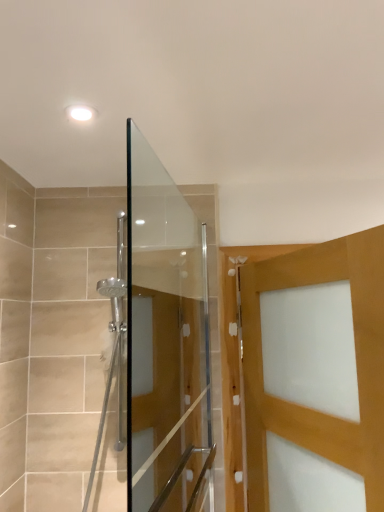
The width and height of the screenshot is (384, 512). Describe the element at coordinates (166, 342) in the screenshot. I see `transparent glass shower door at center` at that location.

Where is `transparent glass shower door at center`? This screenshot has width=384, height=512. transparent glass shower door at center is located at coordinates click(x=166, y=342).

What do you see at coordinates (356, 357) in the screenshot? I see `matte wooden door at right` at bounding box center [356, 357].

At what (x,y) coordinates should I click in order to perform the action: click on matte wooden door at right. Please return your answer as a coordinate pair (x, y). The width and height of the screenshot is (384, 512). Looking at the image, I should click on (356, 357).

I want to click on transparent glass shower door at center, so click(166, 342).

Considering the relative positions of matte wooden door at right and transparent glass shower door at center in the image provided, is matte wooden door at right to the right of transparent glass shower door at center from the viewer's perspective?

Indeed, matte wooden door at right is positioned on the right side of transparent glass shower door at center.

Which object is closer to the camera taking this photo, matte wooden door at right or transparent glass shower door at center?

transparent glass shower door at center is closer to the camera.

Is point (314, 445) closer or farther from the camera than point (157, 385)?

Point (314, 445).

From the image's perspective, between matte wooden door at right and transparent glass shower door at center, who is located below?

matte wooden door at right, from the image's perspective.

From a real-world perspective, who is located higher, matte wooden door at right or transparent glass shower door at center?

transparent glass shower door at center.

In terms of width, does matte wooden door at right look wider or thinner when compared to transparent glass shower door at center?

Considering their sizes, matte wooden door at right looks broader than transparent glass shower door at center.

Who is taller, matte wooden door at right or transparent glass shower door at center?

Standing taller between the two is transparent glass shower door at center.

Considering the sizes of objects matte wooden door at right and transparent glass shower door at center in the image provided, who is smaller, matte wooden door at right or transparent glass shower door at center?

Smaller between the two is transparent glass shower door at center.

Could transparent glass shower door at center be considered to be inside matte wooden door at right?

Actually, transparent glass shower door at center is outside matte wooden door at right.

Are matte wooden door at right and transparent glass shower door at center making contact?

No, matte wooden door at right is not next to transparent glass shower door at center.

Is transparent glass shower door at center at the back of matte wooden door at right?

Yes, matte wooden door at right is positioned with its back facing transparent glass shower door at center.

How many degrees apart are the facing directions of matte wooden door at right and transparent glass shower door at center?

matte wooden door at right and transparent glass shower door at center are facing 27.4 degrees away from each other.

Where is `door below the transparent glass shower door at center (from a real-world perspective)`? This screenshot has width=384, height=512. door below the transparent glass shower door at center (from a real-world perspective) is located at coordinates (356, 357).

Which object is positioned more to the left, transparent glass shower door at center or matte wooden door at right?

Positioned to the left is transparent glass shower door at center.

Is transparent glass shower door at center positioned before matte wooden door at right?

That is True.

Considering the points (203, 389) and (365, 308), which point is behind, point (203, 389) or point (365, 308)?

The point (203, 389) is more distant.

From the image's perspective, who appears lower, transparent glass shower door at center or matte wooden door at right?

From the image's view, matte wooden door at right is below.

From a real-world perspective, is transparent glass shower door at center positioned under matte wooden door at right based on gravity?

No.

Which object is wider, transparent glass shower door at center or matte wooden door at right?

Wider between the two is matte wooden door at right.

Does transparent glass shower door at center have a lesser height compared to matte wooden door at right?

In fact, transparent glass shower door at center may be taller than matte wooden door at right.

Considering the relative sizes of transparent glass shower door at center and matte wooden door at right in the image provided, is transparent glass shower door at center smaller than matte wooden door at right?

Yes, transparent glass shower door at center is smaller than matte wooden door at right.

Is transparent glass shower door at center not inside matte wooden door at right?

Yes, transparent glass shower door at center is located beyond the bounds of matte wooden door at right.

Looking at this image, is there a large distance between transparent glass shower door at center and matte wooden door at right?

No, transparent glass shower door at center is in close proximity to matte wooden door at right.

Is transparent glass shower door at center positioned with its back to matte wooden door at right?

Correct, transparent glass shower door at center is looking away from matte wooden door at right.

How much distance is there between transparent glass shower door at center and matte wooden door at right?

They are 12.98 inches apart.

This screenshot has height=512, width=384. What are the coordinates of `door located on the right of transparent glass shower door at center` in the screenshot? It's located at (356, 357).

In order to click on door below the transparent glass shower door at center (from the image's perspective) in this screenshot , I will do `click(356, 357)`.

Locate an element on the screen. Image resolution: width=384 pixels, height=512 pixels. door lying on the right of transparent glass shower door at center is located at coordinates (x=356, y=357).